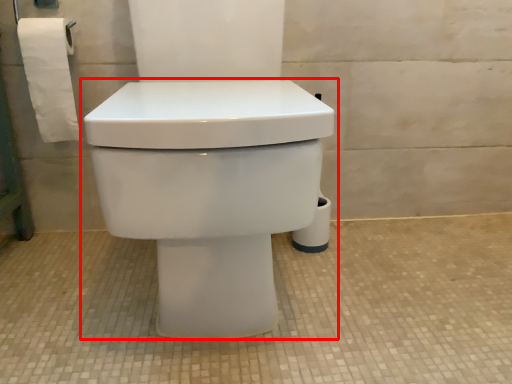
Question: From the image's perspective, what is the correct spatial relationship of toilet (annotated by the red box) in relation to toilet paper?

Choices:
 (A) above
 (B) below

Answer: (B)